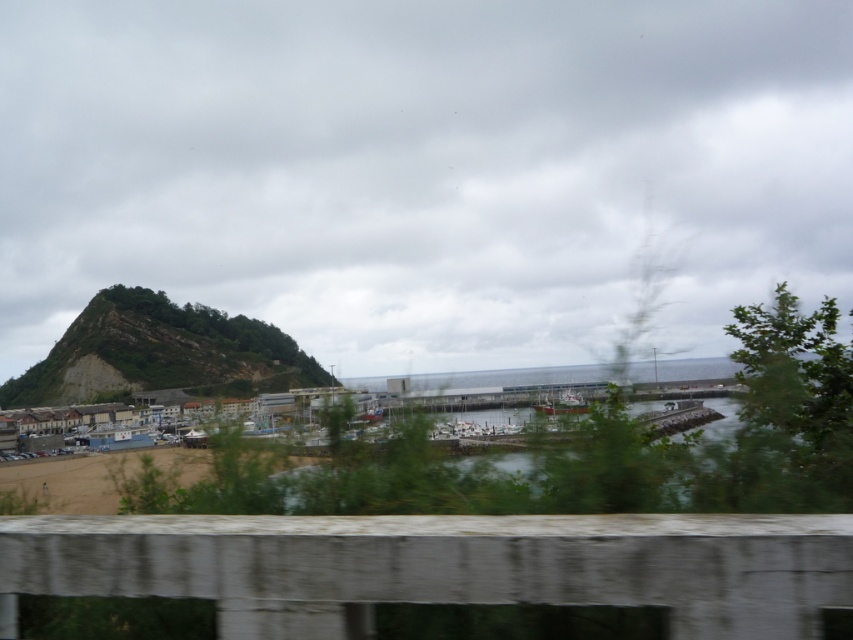
Who is positioned more to the right, clear water at center or green rocky hill at left?

clear water at center

Who is higher up, clear water at center or green rocky hill at left?

clear water at center

What do you see at coordinates (570, 474) in the screenshot? I see `clear water at center` at bounding box center [570, 474].

Image resolution: width=853 pixels, height=640 pixels. Find the location of `clear water at center`. clear water at center is located at coordinates (570, 474).

Measure the distance between green rocky hill at left and camera.

green rocky hill at left is 45.27 meters away from camera.

Between point (257, 376) and point (573, 620), which one is positioned in front?

Point (573, 620) is more forward.

Which is behind, point (42, 362) or point (646, 614)?

The point (42, 362) is behind.

Locate an element on the screen. green rocky hill at left is located at coordinates (160, 353).

Does clear water at center lie behind brown sand at lower left?

No, it is not.

Describe the element at coordinates (570, 474) in the screenshot. I see `clear water at center` at that location.

This screenshot has width=853, height=640. Identify the location of clear water at center. (570, 474).